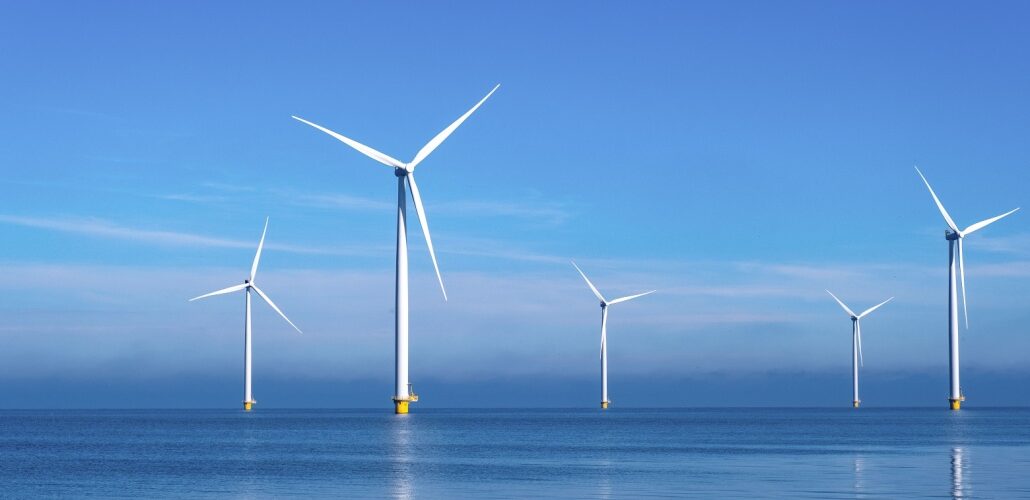
This screenshot has width=1030, height=500. In order to click on wind fan in this screenshot , I will do `click(951, 232)`, `click(848, 310)`, `click(606, 301)`, `click(400, 169)`, `click(244, 290)`.